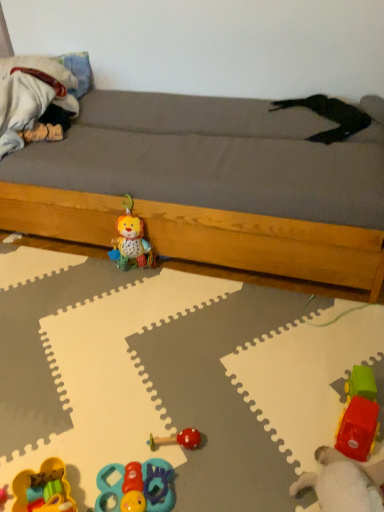
Identify the location of empty space that is in between plush fabric lion at center, arranged as the 5th toy when viewed from the right, and rubberized blue and red toy at lower center, which appears as the third toy when viewed from the left. coord(136,362).